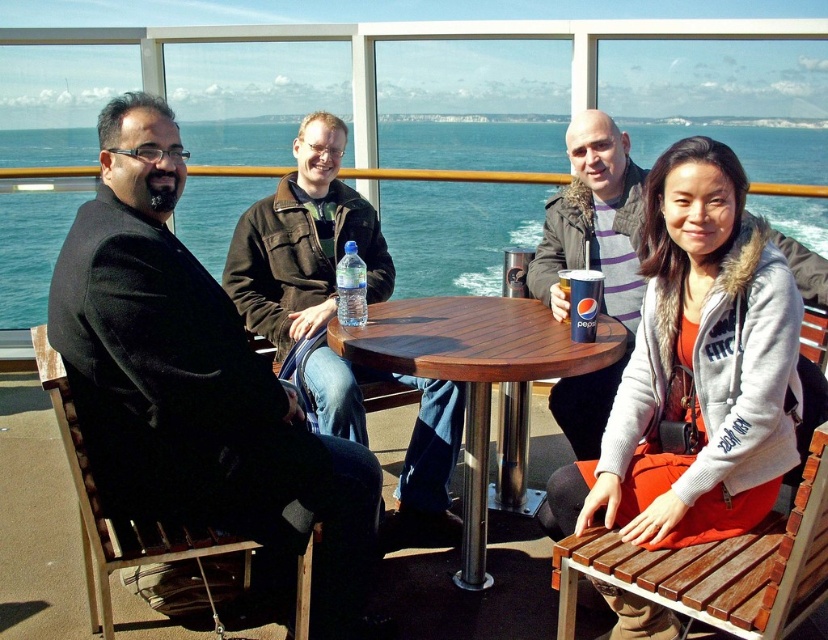
Can you confirm if orange fabric jacket at lower right is wider than gray woolen sweater at center?

Yes.

What do you see at coordinates (697, 369) in the screenshot? The width and height of the screenshot is (828, 640). I see `orange fabric jacket at lower right` at bounding box center [697, 369].

You are a GUI agent. You are given a task and a screenshot of the screen. Output one action in this format:
    pyautogui.click(x=<x>, y=<y>)
    Task: Click on the orange fabric jacket at lower right
    
    Given the screenshot: What is the action you would take?
    pyautogui.click(x=697, y=369)

Measure the distance between point (762, 508) and camera.

A distance of 2.02 meters exists between point (762, 508) and camera.

Where is `orange fabric jacket at lower right`? This screenshot has width=828, height=640. orange fabric jacket at lower right is located at coordinates (697, 369).

Is point (244, 451) positioned after point (381, 236)?

No, (244, 451) is in front of (381, 236).

Image resolution: width=828 pixels, height=640 pixels. I want to click on black wool coat at left, so click(x=196, y=381).